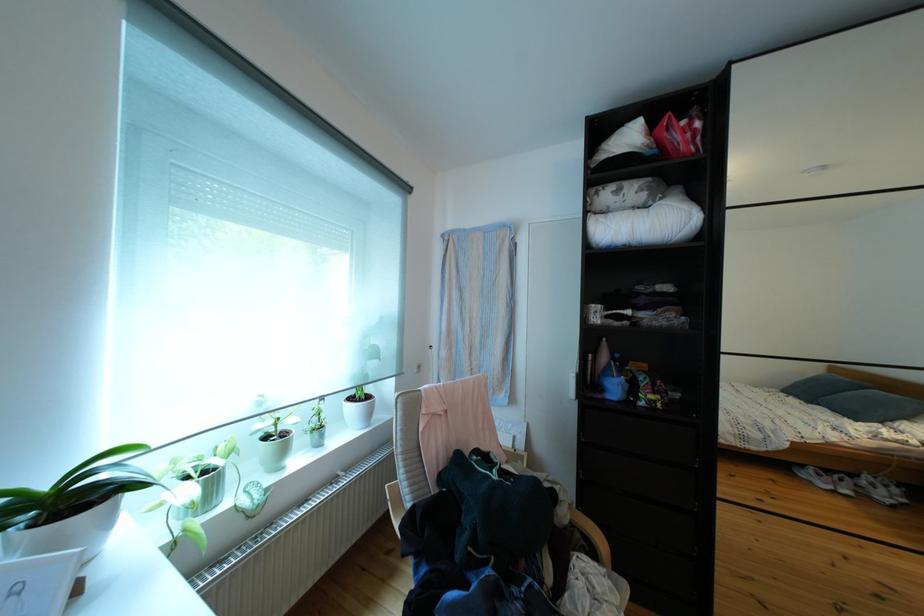
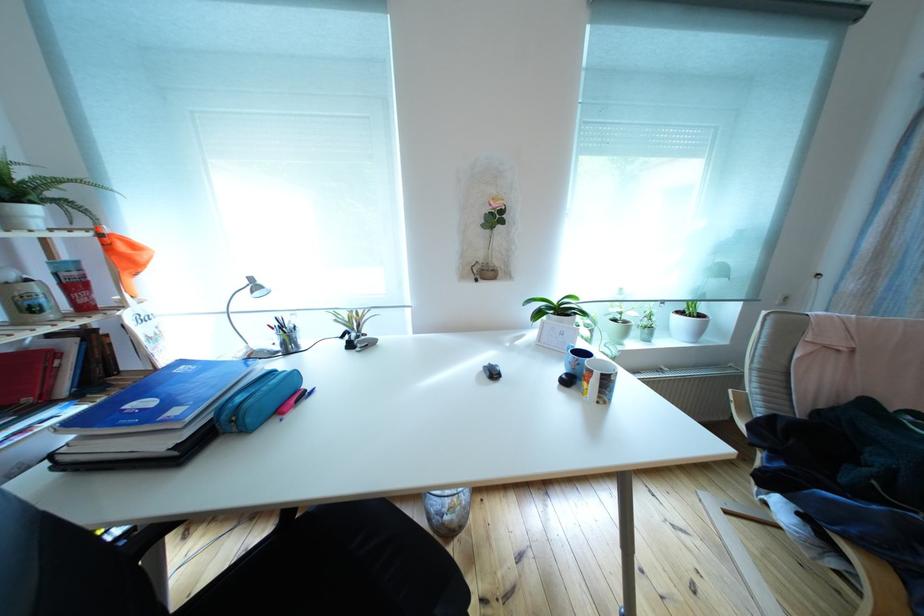
The first image is from the beginning of the video and the second image is from the end. How did the camera likely rotate when shooting the video?

The camera rotated toward left-down.